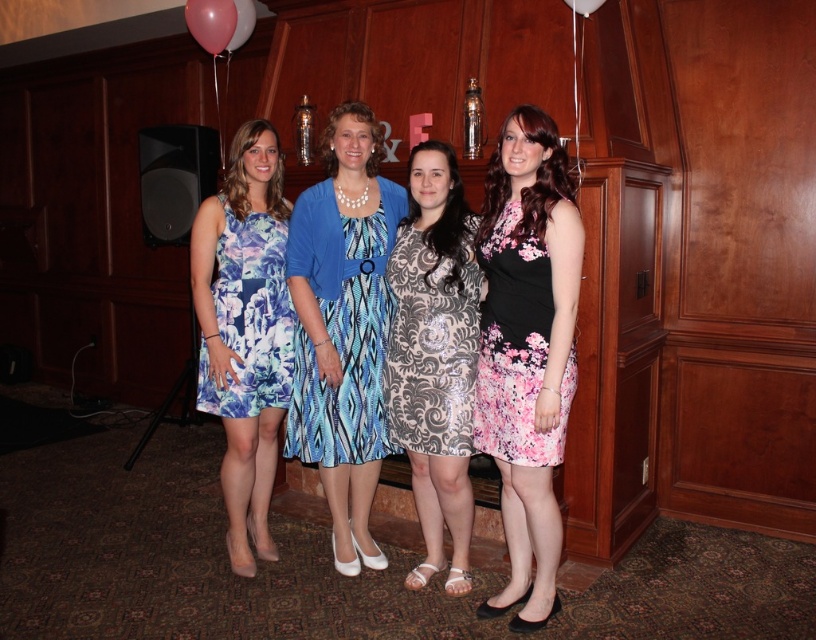
Question: Which point is farther from the camera taking this photo?

Choices:
 (A) (311, 269)
 (B) (557, 180)

Answer: (A)

Question: Which point is farther from the camera taking this photo?

Choices:
 (A) (249, 24)
 (B) (570, 360)
 (C) (384, 452)
 (D) (262, 248)

Answer: (A)

Question: Which point appears closest to the camera in this image?

Choices:
 (A) 251,32
 (B) 588,10
 (C) 238,320

Answer: (B)

Question: Does floral satin dress at center appear on the right side of floral print fabric dress at left?

Choices:
 (A) no
 (B) yes

Answer: (B)

Question: Is floral print dress at center above floral print fabric dress at left?

Choices:
 (A) no
 (B) yes

Answer: (A)

Question: Is floral print fabric dress at left to the right of pink glossy balloon at upper left from the viewer's perspective?

Choices:
 (A) no
 (B) yes

Answer: (B)